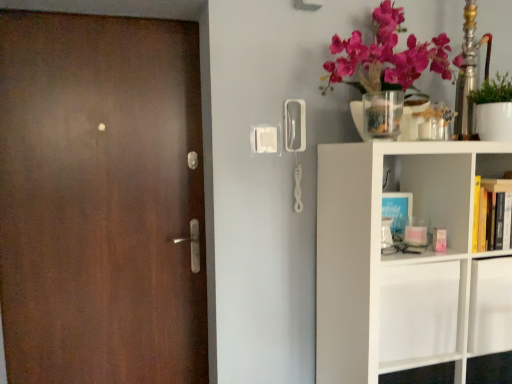
What do you see at coordinates (100, 200) in the screenshot? I see `matte brown door at left` at bounding box center [100, 200].

Locate an element on the screen. Image resolution: width=512 pixels, height=384 pixels. white matte shelf at right is located at coordinates (405, 262).

Locate an element on the screen. matte brown door at left is located at coordinates (100, 200).

Considering the sizes of objects green matte plant at upper right and white matte shelf at right in the image provided, who is bigger, green matte plant at upper right or white matte shelf at right?

Bigger between the two is white matte shelf at right.

At what (x,y) coordinates should I click in order to perform the action: click on houseplant on the right of white matte shelf at right. Please return your answer as a coordinate pair (x, y). This screenshot has height=384, width=512. Looking at the image, I should click on (493, 109).

From a real-world perspective, which object stands above the other?

green matte plant at upper right is physically above.

Considering the relative positions of green matte plant at upper right and white matte shelf at right in the image provided, is green matte plant at upper right in front of white matte shelf at right?

No, it is behind white matte shelf at right.

Can we say matte brown door at left lies outside clear glass vase at upper right?

Yes, matte brown door at left is not within clear glass vase at upper right.

Considering the sizes of objects matte brown door at left and clear glass vase at upper right in the image provided, who is wider, matte brown door at left or clear glass vase at upper right?

With larger width is clear glass vase at upper right.

Which object is more forward, matte brown door at left or clear glass vase at upper right?

clear glass vase at upper right is in front.

Between matte brown door at left and clear glass vase at upper right, which one has smaller size?

With smaller size is clear glass vase at upper right.

From the image's perspective, is white matte shelf at right above or below green matte plant at upper right?

From the image's perspective, white matte shelf at right appears below green matte plant at upper right.

From a real-world perspective, which is physically below, white matte shelf at right or green matte plant at upper right?

white matte shelf at right is physically lower.

Does white matte shelf at right come behind green matte plant at upper right?

No.

Considering the sizes of objects white matte shelf at right and green matte plant at upper right in the image provided, who is shorter, white matte shelf at right or green matte plant at upper right?

Standing shorter between the two is green matte plant at upper right.

From the image's perspective, is matte brown door at left beneath green matte plant at upper right?

Yes, from the image's perspective, matte brown door at left is below green matte plant at upper right.

This screenshot has width=512, height=384. I want to click on houseplant above the matte brown door at left (from a real-world perspective), so click(x=493, y=109).

Is matte brown door at left inside or outside of green matte plant at upper right?

matte brown door at left is not inside green matte plant at upper right, it's outside.

Between matte brown door at left and green matte plant at upper right, which one has more height?

With more height is matte brown door at left.

Based on the photo, which is in front, green matte plant at upper right or matte brown door at left?

green matte plant at upper right is more forward.

Consider the image. How different are the orientations of green matte plant at upper right and matte brown door at left in degrees?

They differ by 1.76 degrees in their facing directions.

From a real-world perspective, does green matte plant at upper right sit lower than matte brown door at left?

No, from a real-world perspective, green matte plant at upper right is not below matte brown door at left.

Is green matte plant at upper right placed right next to matte brown door at left?

No.

Who is taller, green matte plant at upper right or clear glass vase at upper right?

Standing taller between the two is green matte plant at upper right.

Identify the location of vase in front of the green matte plant at upper right. The width and height of the screenshot is (512, 384). (383, 114).

Are green matte plant at upper right and clear glass vase at upper right located far from each other?

No.

Do you think green matte plant at upper right is within clear glass vase at upper right, or outside of it?

green matte plant at upper right is spatially situated outside clear glass vase at upper right.

Does white matte shelf at right have a greater height compared to clear glass vase at upper right?

Yes, white matte shelf at right is taller than clear glass vase at upper right.

Which of these two, white matte shelf at right or clear glass vase at upper right, is bigger?

white matte shelf at right is bigger.

From the image's perspective, would you say white matte shelf at right is positioned over clear glass vase at upper right?

Incorrect, from the image's perspective, white matte shelf at right is lower than clear glass vase at upper right.

Does point (463, 218) appear closer or farther from the camera than point (385, 97)?

Point (463, 218) appears to be closer to the viewer than point (385, 97).

The image size is (512, 384). Identify the location of houseplant above the white matte shelf at right (from the image's perspective). (493, 109).

Where is `door on the left side of clear glass vase at upper right`? The width and height of the screenshot is (512, 384). door on the left side of clear glass vase at upper right is located at coordinates (100, 200).

From the image, which object appears to be farther from matte brown door at left, white matte shelf at right or green matte plant at upper right?

Based on the image, green matte plant at upper right appears to be further to matte brown door at left.

Consider the image. Which object lies further to the anchor point matte brown door at left, white matte shelf at right or clear glass vase at upper right?

The object further to matte brown door at left is clear glass vase at upper right.

From the picture: From the image, which object appears to be nearer to matte brown door at left, green matte plant at upper right or clear glass vase at upper right?

clear glass vase at upper right is closer to matte brown door at left.

Looking at the image, which one is located closer to white matte shelf at right, matte brown door at left or green matte plant at upper right?

green matte plant at upper right lies closer to white matte shelf at right than the other object.

Looking at this image, when comparing their distances from matte brown door at left, does clear glass vase at upper right or white matte shelf at right seem further?

clear glass vase at upper right.

Based on the photo, considering their positions, is white matte shelf at right positioned further to green matte plant at upper right than matte brown door at left?

matte brown door at left is positioned further to the anchor green matte plant at upper right.

Based on their spatial positions, is green matte plant at upper right or matte brown door at left further from clear glass vase at upper right?

matte brown door at left lies further to clear glass vase at upper right than the other object.

Which object lies further to the anchor point matte brown door at left, clear glass vase at upper right or green matte plant at upper right?

green matte plant at upper right lies further to matte brown door at left than the other object.

Find the location of a particular element. vase situated between matte brown door at left and white matte shelf at right from left to right is located at coordinates (383, 114).

Locate an element on the screen. This screenshot has width=512, height=384. shelf between matte brown door at left and green matte plant at upper right in the horizontal direction is located at coordinates (405, 262).

This screenshot has height=384, width=512. Find the location of `vase between green matte plant at upper right and white matte shelf at right vertically`. vase between green matte plant at upper right and white matte shelf at right vertically is located at coordinates (383, 114).

The height and width of the screenshot is (384, 512). Find the location of `vase located between matte brown door at left and green matte plant at upper right in the left-right direction`. vase located between matte brown door at left and green matte plant at upper right in the left-right direction is located at coordinates (383, 114).